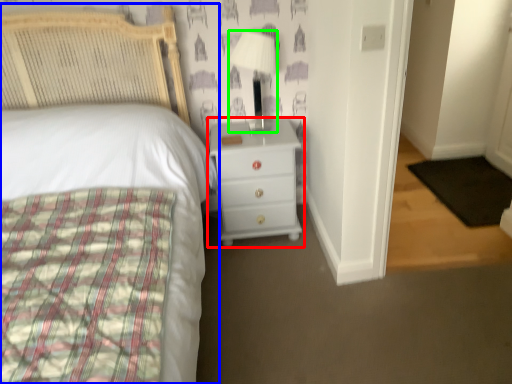
Question: Considering the real-world distances, which object is farthest from chest of drawers (highlighted by a red box)? bed (highlighted by a blue box) or lamp (highlighted by a green box)?

Choices:
 (A) bed
 (B) lamp

Answer: (B)